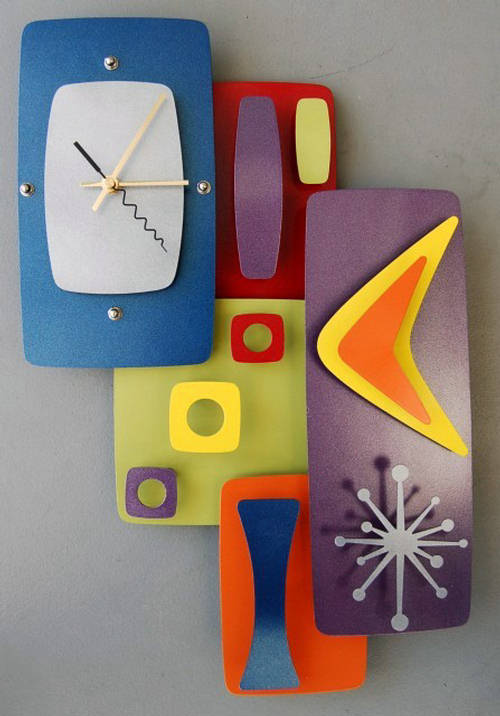
Where is `clock`? The width and height of the screenshot is (500, 716). clock is located at coordinates (101, 243).